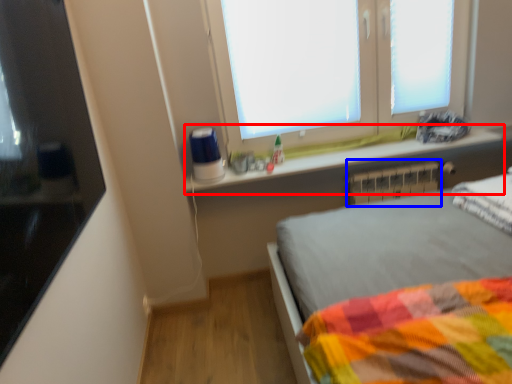
Question: Which of the following is the closest to the observer, window sill (highlighted by a red box) or radiator (highlighted by a blue box)?

Choices:
 (A) window sill
 (B) radiator

Answer: (A)